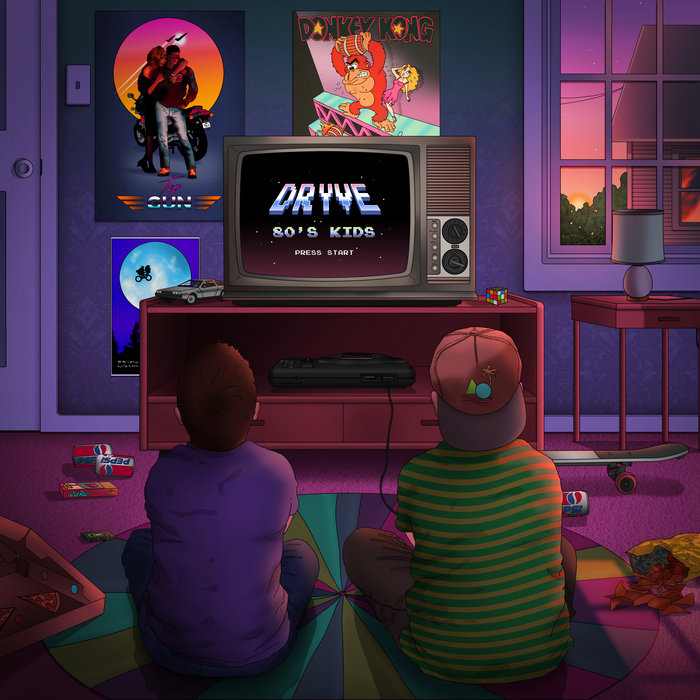
This screenshot has height=700, width=700. What are the coordinates of `posters` in the screenshot? It's located at (173, 75), (407, 64), (122, 360).